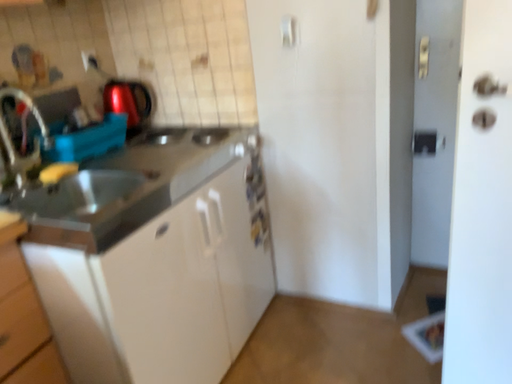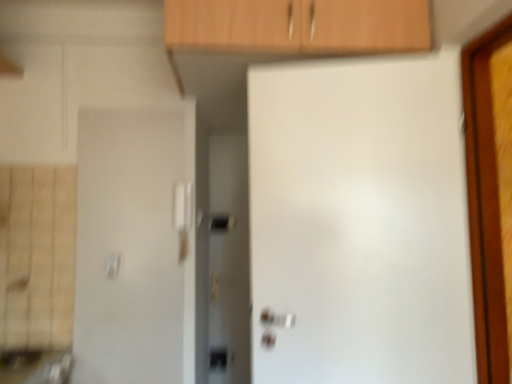
Question: How did the camera likely rotate when shooting the video?

Choices:
 (A) rotated upward
 (B) rotated downward

Answer: (A)